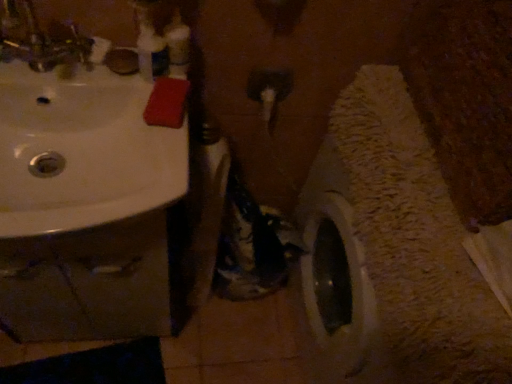
Identify the location of translucent plastic bottle at upper center. (177, 46).

This screenshot has height=384, width=512. I want to click on translucent plastic bottle at upper center, so 177,46.

Is translucent plastic bottle at upper center in front of white glossy sink at upper left?

No, the depth of translucent plastic bottle at upper center is greater than that of white glossy sink at upper left.

Looking at the image, does translucent plastic bottle at upper center seem bigger or smaller compared to white glossy sink at upper left?

Considering their sizes, translucent plastic bottle at upper center takes up less space than white glossy sink at upper left.

Between translucent plastic bottle at upper center and white glossy sink at upper left, which one has larger width?

white glossy sink at upper left is wider.

Is translucent plastic bottle at upper center aimed at white glossy sink at upper left?

No, translucent plastic bottle at upper center is not facing towards white glossy sink at upper left.

Considering the sizes of objects white glossy sink at upper left and translucent plastic bottle at upper center in the image provided, who is thinner, white glossy sink at upper left or translucent plastic bottle at upper center?

translucent plastic bottle at upper center is thinner.

From the image's perspective, which is above, white glossy sink at upper left or translucent plastic bottle at upper center?

translucent plastic bottle at upper center.

What's the angular difference between white glossy sink at upper left and translucent plastic bottle at upper center's facing directions?

The facing directions of white glossy sink at upper left and translucent plastic bottle at upper center are 7.96e-05 degrees apart.

Can we say white glossy sink at upper left lies outside translucent plastic bottle at upper center?

Absolutely, white glossy sink at upper left is external to translucent plastic bottle at upper center.

Is translucent plastic bottle at upper center positioned with its back to brushed metal faucet at upper left?

No, translucent plastic bottle at upper center is not facing the opposite direction of brushed metal faucet at upper left.

Is translucent plastic bottle at upper center outside of brushed metal faucet at upper left?

Yes, translucent plastic bottle at upper center is not within brushed metal faucet at upper left.

Which is less distant, (x=180, y=21) or (x=87, y=58)?

The point (x=180, y=21) is more forward.

Which of these two, translucent plastic bottle at upper center or brushed metal faucet at upper left, stands shorter?

translucent plastic bottle at upper center is shorter.

From the image's perspective, is white glossy sink at upper left below brushed metal faucet at upper left?

Correct, white glossy sink at upper left appears lower than brushed metal faucet at upper left in the image.

Which is farther from the camera, [51,45] or [7,33]?

Positioned behind is point [51,45].

In the scene shown: In terms of height, does white glossy sink at upper left look taller or shorter compared to brushed metal faucet at upper left?

Clearly, white glossy sink at upper left is shorter compared to brushed metal faucet at upper left.

In the image, there is a white glossy sink at upper left. Identify the location of tap above it (from the image's perspective). This screenshot has height=384, width=512. (40, 38).

From the image's perspective, is brushed metal faucet at upper left below white glossy sink at upper left?

Incorrect, from the image's perspective, brushed metal faucet at upper left is higher than white glossy sink at upper left.

Is brushed metal faucet at upper left to the left or to the right of white glossy sink at upper left in the image?

brushed metal faucet at upper left is positioned on white glossy sink at upper left's left side.

Which object is more forward, brushed metal faucet at upper left or white glossy sink at upper left?

Positioned in front is brushed metal faucet at upper left.

Measure the distance between brushed metal faucet at upper left and translucent plastic bottle at upper center.

brushed metal faucet at upper left and translucent plastic bottle at upper center are 19.92 centimeters apart.

Which object is positioned more to the left, brushed metal faucet at upper left or translucent plastic bottle at upper center?

brushed metal faucet at upper left is more to the left.

Is translucent plastic bottle at upper center at the back of brushed metal faucet at upper left?

No.

Between brushed metal faucet at upper left and translucent plastic bottle at upper center, which one has smaller width?

translucent plastic bottle at upper center is thinner.

Locate an element on the screen. toiletry located above the white glossy sink at upper left (from a real-world perspective) is located at coordinates (177, 46).

Where is `toiletry above the white glossy sink at upper left (from the image's perspective)`? Image resolution: width=512 pixels, height=384 pixels. toiletry above the white glossy sink at upper left (from the image's perspective) is located at coordinates (177, 46).

Which object lies nearer to the anchor point translucent plastic bottle at upper center, white glossy sink at upper left or brushed metal faucet at upper left?

white glossy sink at upper left.

Considering their positions, is brushed metal faucet at upper left positioned further to white glossy sink at upper left than translucent plastic bottle at upper center?

translucent plastic bottle at upper center.

In the scene shown: Based on their spatial positions, is translucent plastic bottle at upper center or white glossy sink at upper left closer to brushed metal faucet at upper left?

white glossy sink at upper left is positioned closer to the anchor brushed metal faucet at upper left.

When comparing their distances from brushed metal faucet at upper left, does white glossy sink at upper left or translucent plastic bottle at upper center seem closer?

white glossy sink at upper left is positioned closer to the anchor brushed metal faucet at upper left.

From the image, which object appears to be nearer to translucent plastic bottle at upper center, brushed metal faucet at upper left or white glossy sink at upper left?

Among the two, white glossy sink at upper left is located nearer to translucent plastic bottle at upper center.

Based on their spatial positions, is translucent plastic bottle at upper center or brushed metal faucet at upper left further from white glossy sink at upper left?

translucent plastic bottle at upper center is positioned further to the anchor white glossy sink at upper left.

Find the location of a particular element. The height and width of the screenshot is (384, 512). tap between translucent plastic bottle at upper center and white glossy sink at upper left in the up-down direction is located at coordinates (40, 38).